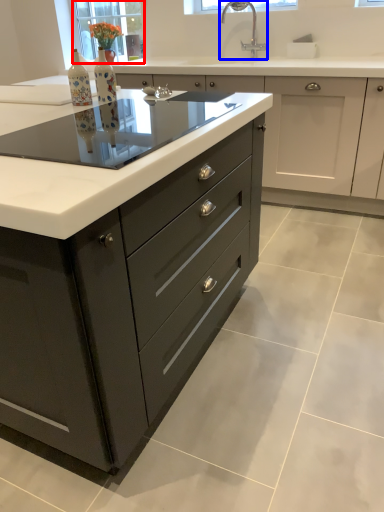
Question: Which point is further to the camera, window screen (highlighted by a red box) or tap (highlighted by a blue box)?

Choices:
 (A) window screen
 (B) tap

Answer: (A)